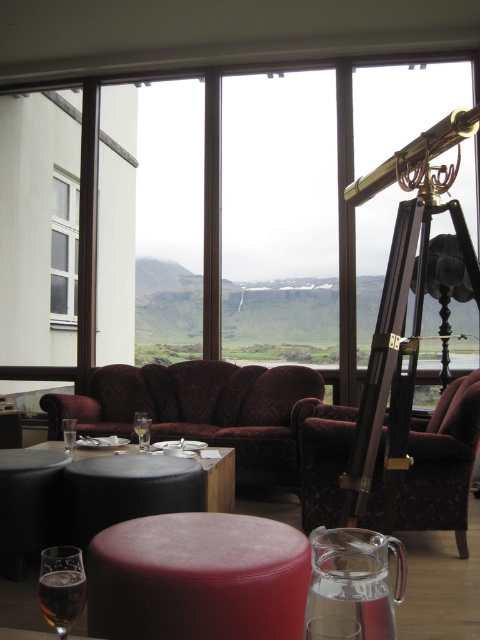
Is amber glass at lower left thinner than clear glass wine glass at lower left?

In fact, amber glass at lower left might be wider than clear glass wine glass at lower left.

The width and height of the screenshot is (480, 640). Describe the element at coordinates (61, 586) in the screenshot. I see `amber glass at lower left` at that location.

Where is `amber glass at lower left`? The image size is (480, 640). amber glass at lower left is located at coordinates (61, 586).

Is velvet red stool at center in front of black leather table at center?

Yes, velvet red stool at center is closer to the viewer.

I want to click on velvet red stool at center, so click(x=197, y=579).

This screenshot has height=640, width=480. Identify the location of velvet red stool at center. (197, 579).

Is white plastic window at upper left below clear glass wine glass at lower left?

No.

Between white plastic window at upper left and clear glass wine glass at lower left, which one is positioned higher?

Positioned higher is white plastic window at upper left.

Between point (63, 280) and point (72, 451), which one is positioned behind?

The point (63, 280) is behind.

Where is `white plastic window at upper left`? This screenshot has height=640, width=480. white plastic window at upper left is located at coordinates (63, 250).